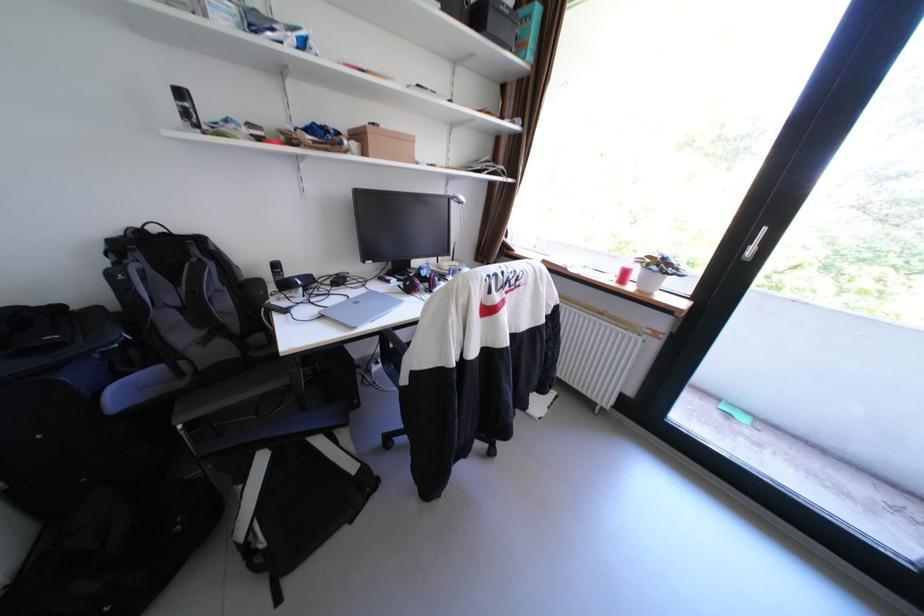
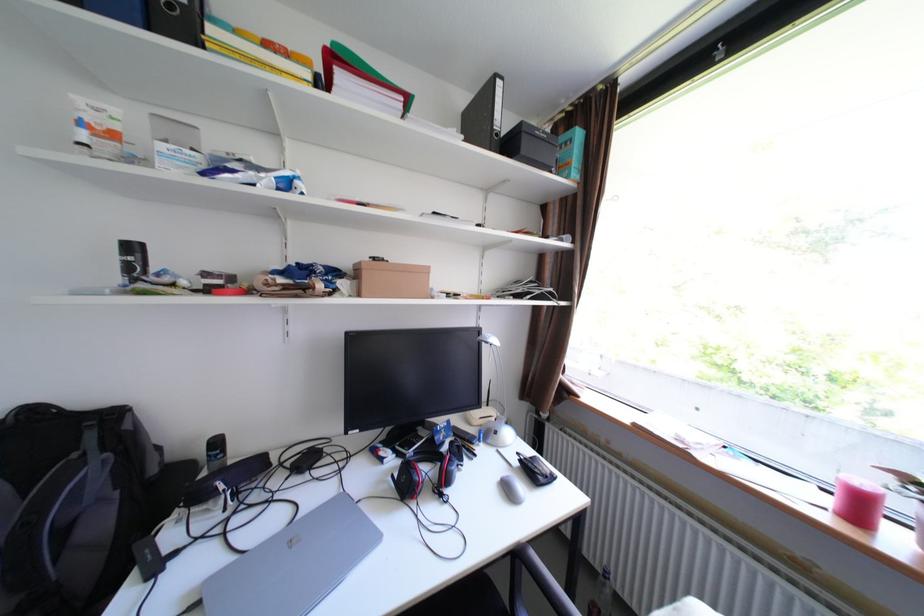
In the second image, find the point that corresponds to point (409, 286) in the first image.

(403, 477)